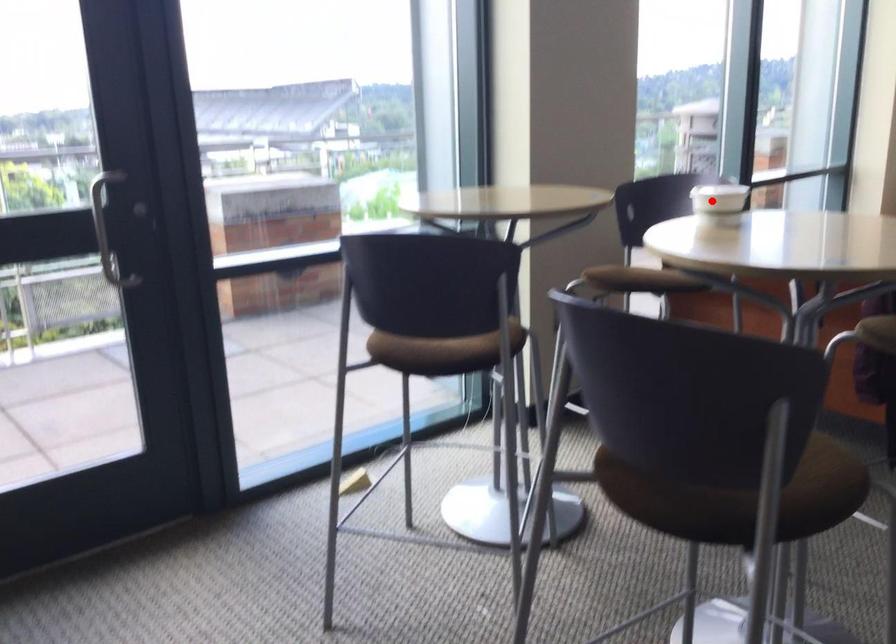
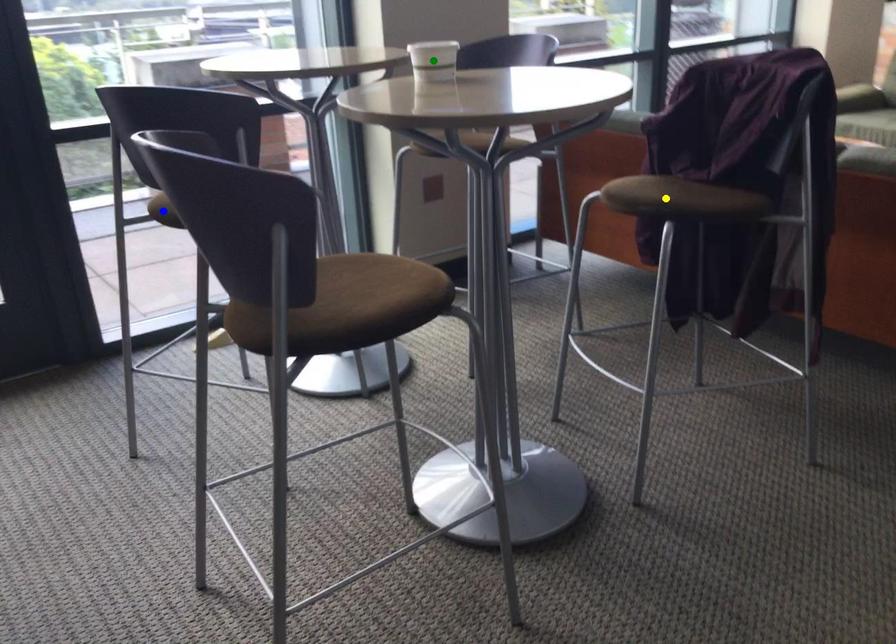
Question: I am providing you with two images of the same scene from different viewpoints. A red point is marked on the first image. You are given multiple points on the second image. Which mark in image 2 goes with the point in image 1?

Choices:
 (A) blue point
 (B) yellow point
 (C) green point

Answer: (C)